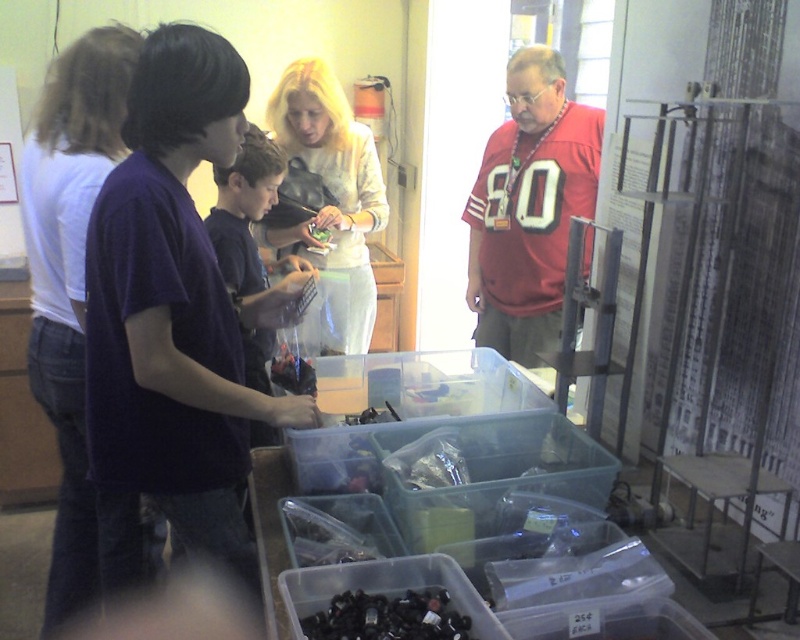
Is white cotton shirt at left bigger than black plastic bottle at lower center?

Yes.

Which is above, white cotton shirt at left or black plastic bottle at lower center?

white cotton shirt at left is higher up.

Identify the location of white cotton shirt at left. (70, 278).

Which is above, white textured sweater at center or green matte vegetable at center?

white textured sweater at center

Which is more to the left, white textured sweater at center or green matte vegetable at center?

Positioned to the left is white textured sweater at center.

The height and width of the screenshot is (640, 800). Describe the element at coordinates (326, 204) in the screenshot. I see `white textured sweater at center` at that location.

You are a GUI agent. You are given a task and a screenshot of the screen. Output one action in this format:
    pyautogui.click(x=<x>, y=<y>)
    Task: Click on the white textured sweater at center
    The image size is (800, 640).
    Given the screenshot: What is the action you would take?
    pyautogui.click(x=326, y=204)

Is white cotton shirt at left taller than green matte vegetable at center?

Correct, white cotton shirt at left is much taller as green matte vegetable at center.

Who is more distant from viewer, (84, 420) or (308, 228)?

Point (308, 228)

This screenshot has height=640, width=800. Identify the location of white cotton shirt at left. (70, 278).